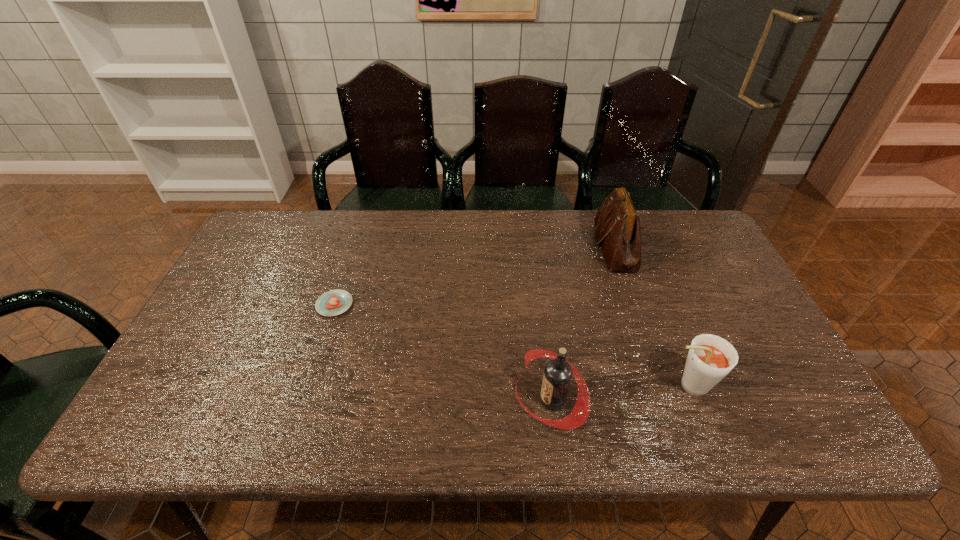
You are a GUI agent. You are given a task and a screenshot of the screen. Output one action in this format:
    pyautogui.click(x=<x>, y=<y>)
    Task: Click on the shoulder bag
    This screenshot has height=540, width=960.
    Given the screenshot: What is the action you would take?
    pyautogui.click(x=617, y=224)

The image size is (960, 540). I want to click on the left root beer, so click(557, 376).

You are a GUI agent. You are given a task and a screenshot of the screen. Output one action in this format:
    pyautogui.click(x=<x>, y=<y>)
    Task: Click on the right root beer
    This screenshot has width=960, height=540.
    Given the screenshot: What is the action you would take?
    pyautogui.click(x=710, y=358)

At what (x,y) coordinates should I click in order to perform the action: click on the third nearest object. Please return your answer as a coordinate pair (x, y). This screenshot has width=960, height=540. Looking at the image, I should click on (334, 302).

Where is `pastry`? pastry is located at coordinates (334, 302).

Find the location of a particular element. The height and width of the screenshot is (540, 960). free spot located 0.230m on the front of the shoulder bag is located at coordinates (645, 338).

Identify the location of vacant region located 0.160m on the label of the third object from right to left. The height and width of the screenshot is (540, 960). (446, 400).

The width and height of the screenshot is (960, 540). Find the location of `vacant area situated 0.150m on the label of the third object from right to left`. vacant area situated 0.150m on the label of the third object from right to left is located at coordinates (451, 400).

At what (x,y) coordinates should I click in order to perform the action: click on vacant space positioned on the label of the third object from right to left. Please return your answer as a coordinate pair (x, y). Image resolution: width=960 pixels, height=540 pixels. Looking at the image, I should click on (481, 400).

Locate an element on the screen. The width and height of the screenshot is (960, 540). blank space located on the drink side of the right root beer is located at coordinates (623, 386).